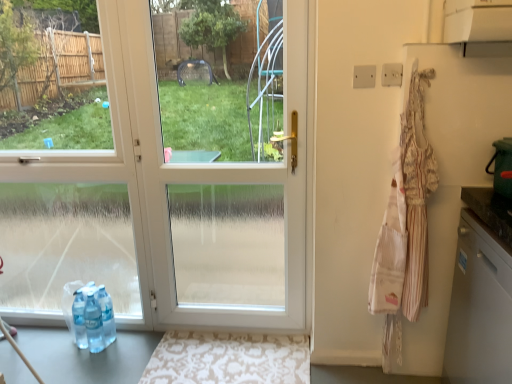
Question: Is beige damask rug at lower center taller or shorter than white glossy dishwasher at right?

Choices:
 (A) short
 (B) tall

Answer: (A)

Question: Considering their positions, is beige damask rug at lower center located in front of or behind white glossy dishwasher at right?

Choices:
 (A) behind
 (B) front

Answer: (A)

Question: Which is farther from the white glossy door at center?

Choices:
 (A) white glossy dishwasher at right
 (B) beige damask rug at lower center
 (C) striped cotton apron at right

Answer: (C)

Question: Estimate the real-world distances between objects in this image. Which object is closer to the white glossy door at center?

Choices:
 (A) striped cotton apron at right
 (B) white glossy dishwasher at right
 (C) beige damask rug at lower center

Answer: (C)